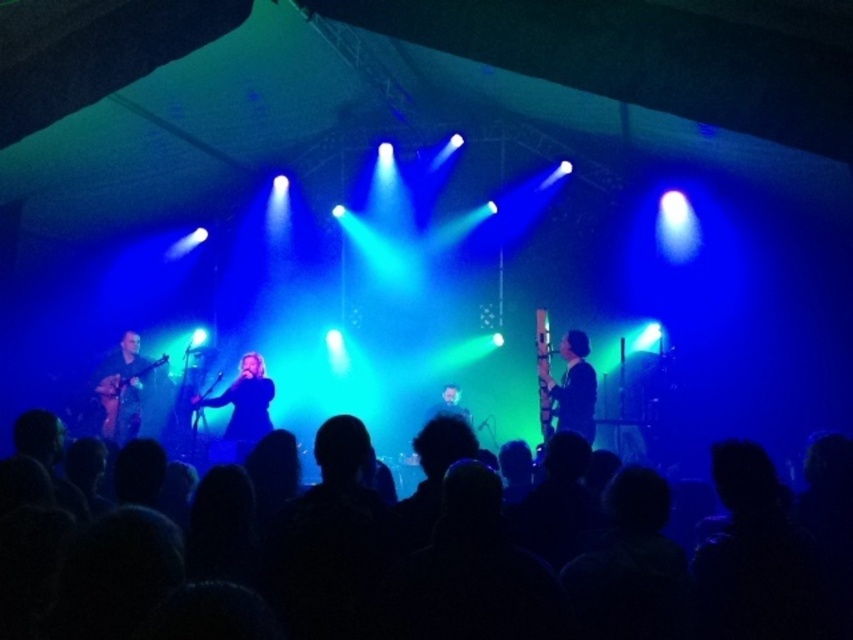
Can you confirm if black silhouettes at lower center is wider than shiny brown guitar at left?

Yes, black silhouettes at lower center is wider than shiny brown guitar at left.

Between black silhouettes at lower center and shiny brown guitar at left, which one is positioned higher?

shiny brown guitar at left

This screenshot has width=853, height=640. Find the location of `black silhouettes at lower center`. black silhouettes at lower center is located at coordinates (79, 563).

Where is `black silhouettes at lower center`? This screenshot has width=853, height=640. black silhouettes at lower center is located at coordinates (79, 563).

Can you confirm if shiny brown guitar at left is positioned to the left of black matte shirt at center?

Correct, you'll find shiny brown guitar at left to the left of black matte shirt at center.

The width and height of the screenshot is (853, 640). Find the location of `shiny brown guitar at left`. shiny brown guitar at left is located at coordinates (123, 387).

Locate an element on the screen. shiny brown guitar at left is located at coordinates (123, 387).

Is dark blue fabric at center positioned in front of shiny brown guitar at left?

Yes, it is in front of shiny brown guitar at left.

Is point (228, 397) positioned after point (141, 372)?

That is False.

Is point (229, 452) positioned before point (117, 436)?

Yes.

Image resolution: width=853 pixels, height=640 pixels. I want to click on dark blue fabric at center, so click(x=242, y=410).